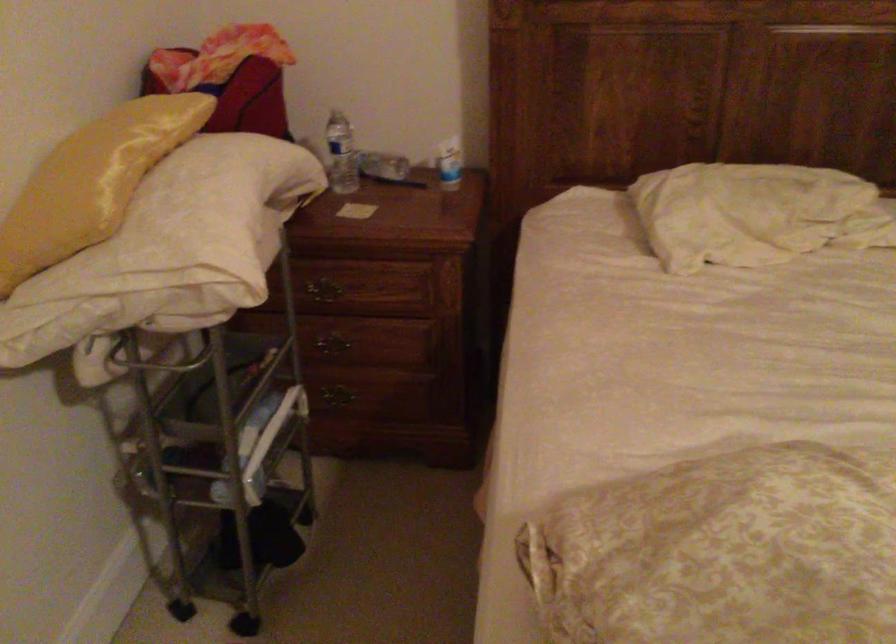
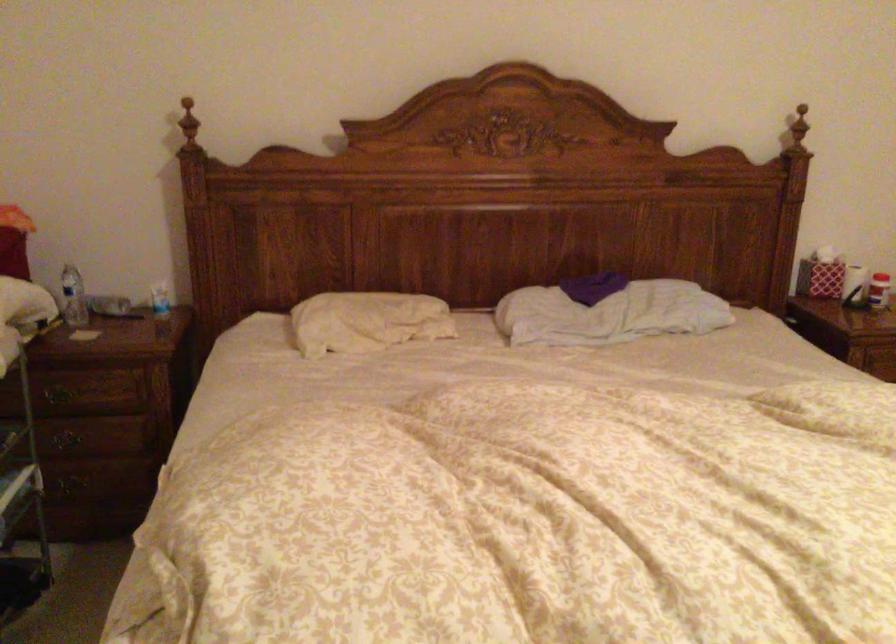
Question: How did the camera likely rotate?

Choices:
 (A) Left
 (B) Right
 (C) Up
 (D) Down

Answer: (B)